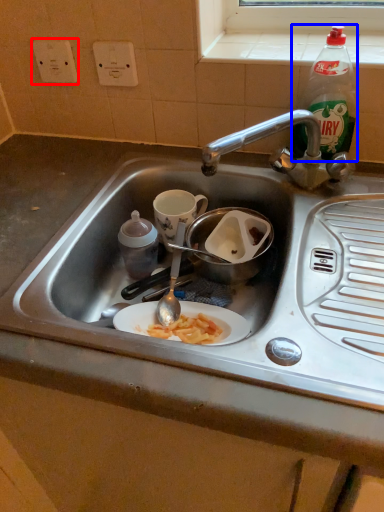
Question: Which object appears farthest to the camera in this image, electric outlet (highlighted by a red box) or bottle (highlighted by a blue box)?

Choices:
 (A) electric outlet
 (B) bottle

Answer: (A)